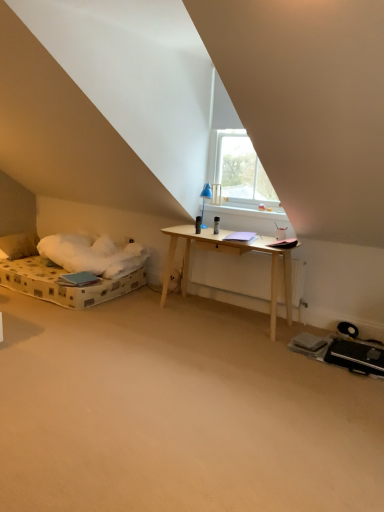
Question: Does point (132, 443) appear closer or farther from the camera than point (11, 250)?

Choices:
 (A) closer
 (B) farther

Answer: (A)

Question: From their relative heights in the image, would you say beige carpet at center is taller or shorter than soft white pillow at left?

Choices:
 (A) short
 (B) tall

Answer: (A)

Question: Which object is positioned farthest from the soft white pillow at left?

Choices:
 (A) transparent glass window at upper center
 (B) beige carpet at center

Answer: (B)

Question: Which object is the closest to the beige carpet at center?

Choices:
 (A) transparent glass window at upper center
 (B) soft white pillow at left

Answer: (A)